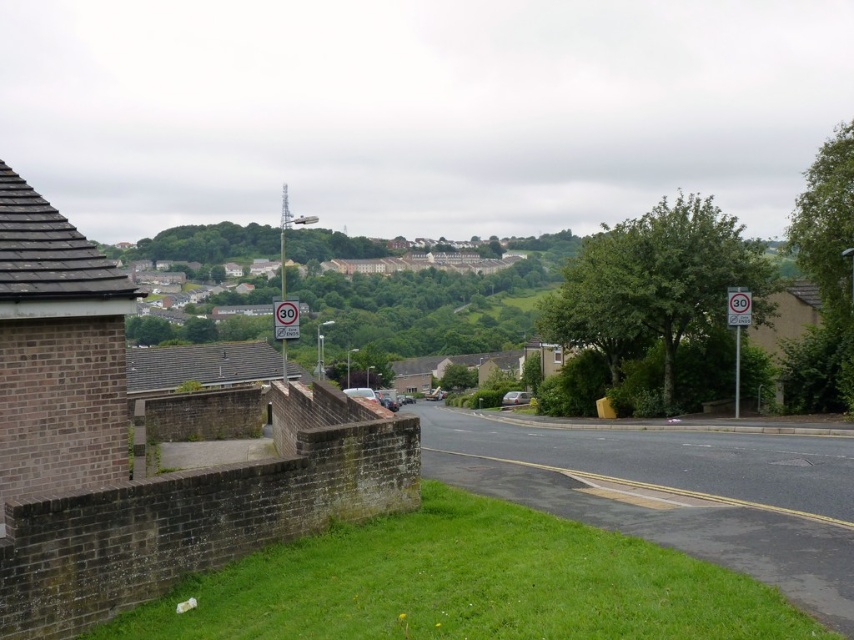
Question: Does white plastic speed limit sign at right have a smaller size compared to metallic silver speed limit sign at center?

Choices:
 (A) no
 (B) yes

Answer: (B)

Question: Is white plastic speed limit sign at right above metallic silver speed limit sign at center?

Choices:
 (A) no
 (B) yes

Answer: (B)

Question: Is white plastic speed limit sign at right further to the viewer compared to metallic silver speed limit sign at center?

Choices:
 (A) no
 (B) yes

Answer: (B)

Question: Which point is farther to the camera?

Choices:
 (A) (276, 301)
 (B) (727, 289)

Answer: (B)